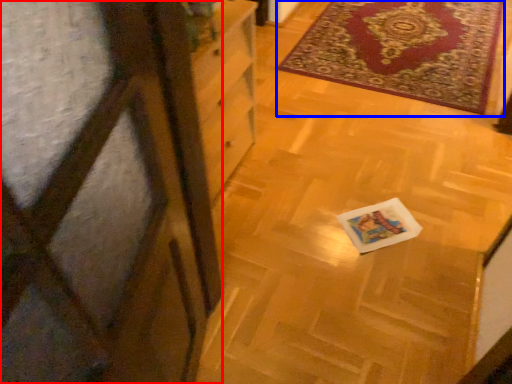
Question: Which point is closer to the camera, screen door (highlighted by a red box) or mat (highlighted by a blue box)?

Choices:
 (A) screen door
 (B) mat

Answer: (A)